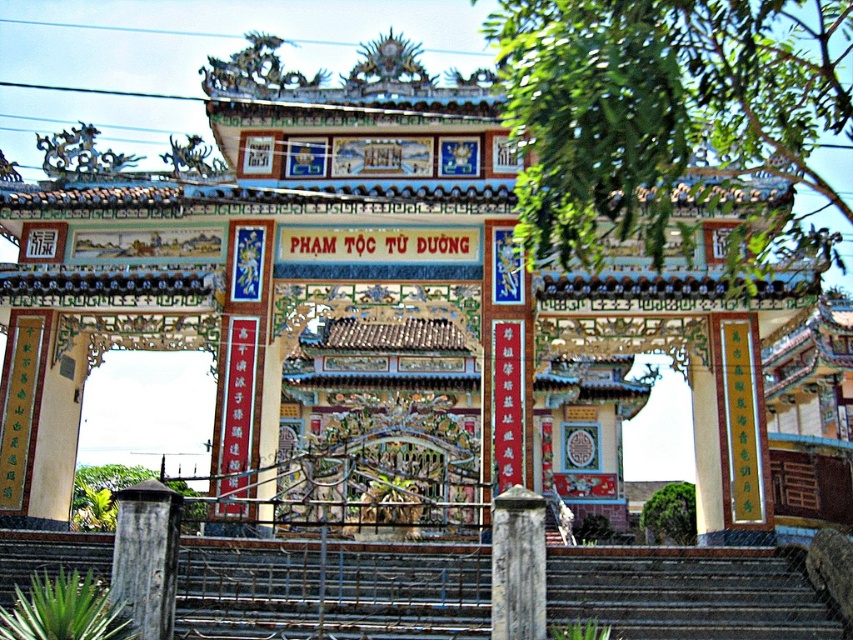
Can you confirm if rusty metal stairs at center is positioned above gray weathered stone pillar at center?

Actually, rusty metal stairs at center is below gray weathered stone pillar at center.

Between rusty metal stairs at center and gray weathered stone pillar at center, which one is positioned lower?

rusty metal stairs at center is below.

Is point (787, 621) positioned in front of point (544, 579)?

No, (787, 621) is further to viewer.

Locate an element on the screen. The image size is (853, 640). rusty metal stairs at center is located at coordinates (685, 593).

Is dark brown wooden post at lower left thinner than gray weathered stone pillar at center?

No, dark brown wooden post at lower left is not thinner than gray weathered stone pillar at center.

Is dark brown wooden post at lower left wider than gray weathered stone pillar at center?

Correct, the width of dark brown wooden post at lower left exceeds that of gray weathered stone pillar at center.

Which is in front, point (136, 554) or point (502, 509)?

Point (136, 554)

Find the location of `dark brown wooden post at lower left`. dark brown wooden post at lower left is located at coordinates point(146,556).

What do you see at coordinates (685, 593) in the screenshot?
I see `rusty metal stairs at center` at bounding box center [685, 593].

Is rusty metal stairs at center shorter than dark brown wooden post at lower left?

Correct, rusty metal stairs at center is not as tall as dark brown wooden post at lower left.

Consider the image. Who is more distant from viewer, (622, 630) or (136, 566)?

Point (622, 630)

Image resolution: width=853 pixels, height=640 pixels. Identify the location of rusty metal stairs at center. (685, 593).